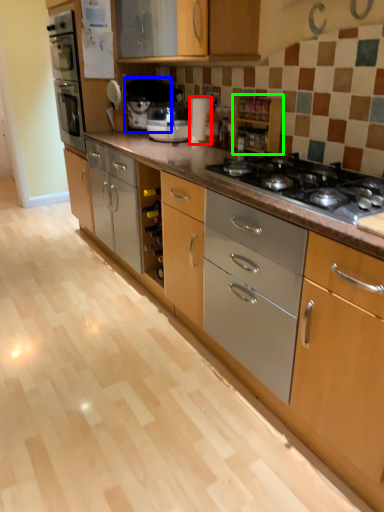
Question: Which object is positioned closest to appliance (highlighted by a red box)? Select from coffee machine (highlighted by a blue box) and cabinetry (highlighted by a green box).

Choices:
 (A) coffee machine
 (B) cabinetry

Answer: (B)